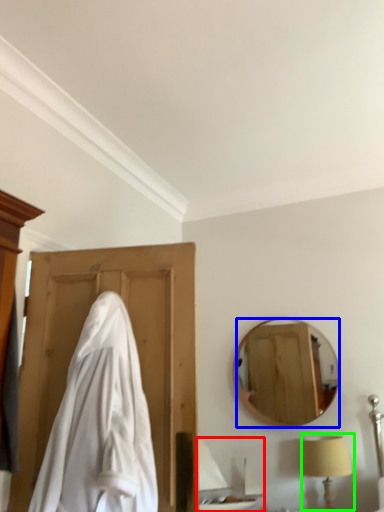
Question: Considering the real-world distances, which object is closest to sink (highlighted by a red box)? mirror (highlighted by a blue box) or table lamp (highlighted by a green box).

Choices:
 (A) mirror
 (B) table lamp

Answer: (B)